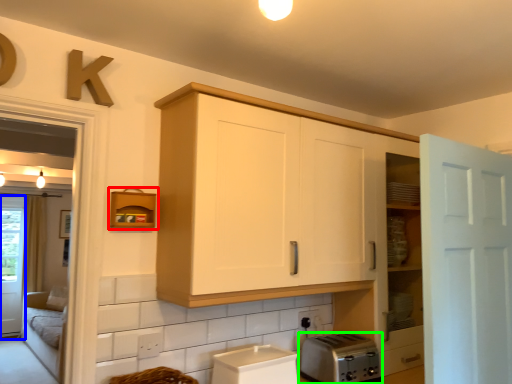
Question: Which object is the closest to the shelf (highlighted by a red box)? Choose among these: screen door (highlighted by a blue box) or toaster (highlighted by a green box).

Choices:
 (A) screen door
 (B) toaster

Answer: (B)